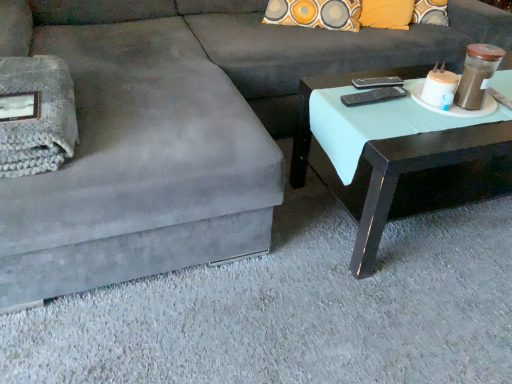
The height and width of the screenshot is (384, 512). What are the coordinates of `vacant space to the right of black plastic remote at upper right, marked as the first remote in a top-to-bottom arrangement` in the screenshot? It's located at (411, 86).